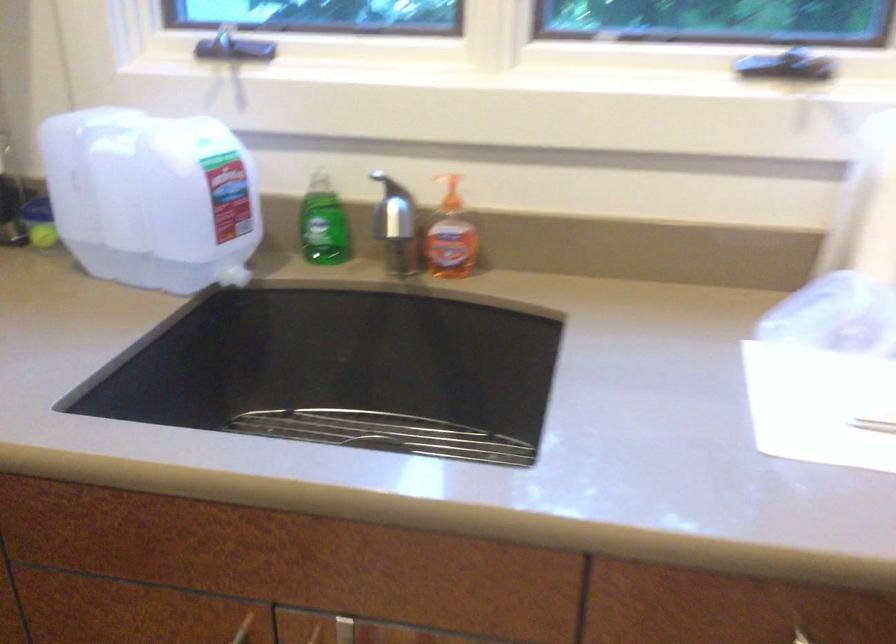
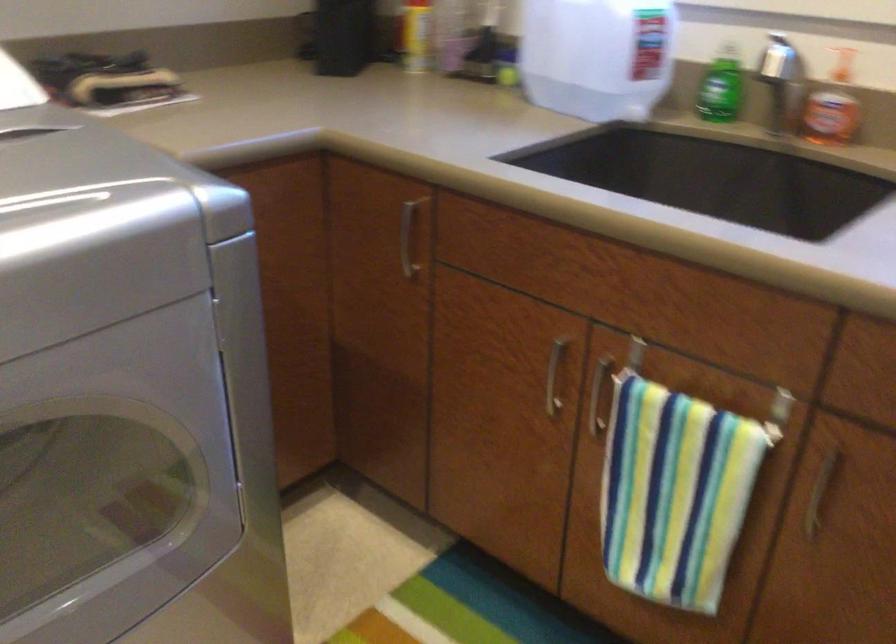
Where in the second image is the point corresponding to point 453,236 from the first image?

(832, 106)